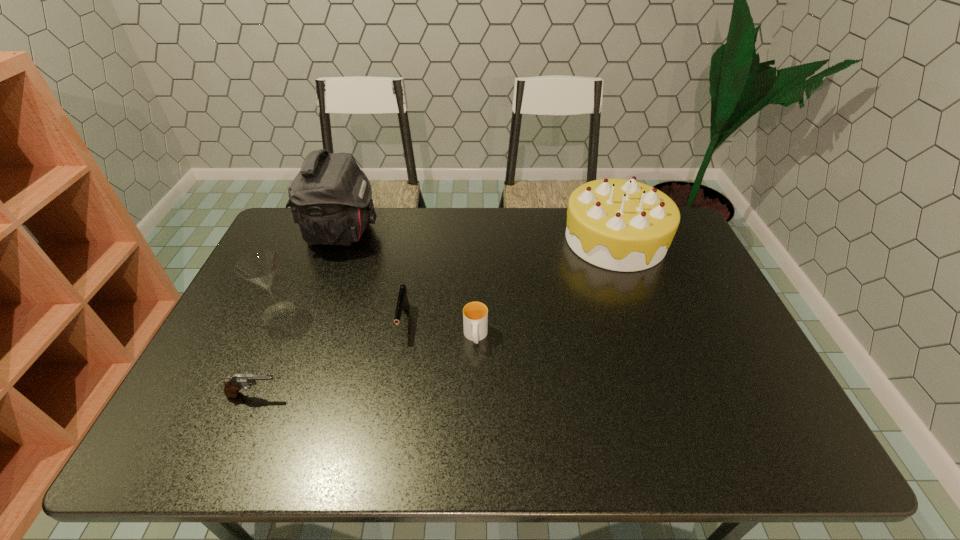
Image resolution: width=960 pixels, height=540 pixels. I want to click on free space located on the right of the flute glass, so click(x=373, y=314).

Identify the location of free space located 0.080m at the muzzle of the third object from right to left. This screenshot has height=540, width=960. click(396, 366).

In order to click on free space located 0.150m at the barrel of the nearer pistol in this screenshot , I will do `click(344, 395)`.

The height and width of the screenshot is (540, 960). Identify the location of vacant area located with the handle on the side of the cup. (475, 392).

This screenshot has height=540, width=960. I want to click on shoulder bag located in the far edge section of the desktop, so click(330, 198).

The width and height of the screenshot is (960, 540). I want to click on birthday cake that is at the far edge, so click(622, 225).

Identify the location of shoulder bag at the left edge. (330, 198).

At what (x,y) coordinates should I click in order to perform the action: click on flute glass that is at the left edge. Please return your answer as a coordinate pair (x, y). Looking at the image, I should click on (260, 267).

Identify the location of pistol that is at the left edge. This screenshot has height=540, width=960. (233, 384).

Locate an element on the screen. Image resolution: width=960 pixels, height=540 pixels. object at the right edge is located at coordinates (622, 225).